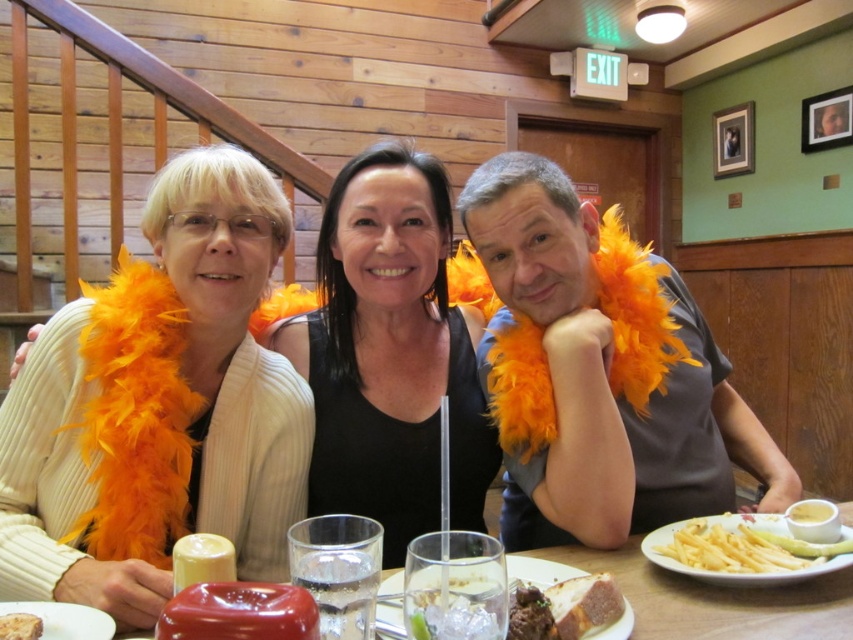
You are a waiter in a restaurant and need to serve a customer who is sitting at the table with the orange feather boa at center and the smooth white cake at center. Which item is blocking the customer from reaching the cake?

The orange feather boa at center is positioned over the smooth white cake at center, so it is blocking the customer from reaching the cake.

You are standing in a restaurant and want to sit at the table where three people are wearing orange feather boas. The table is located at point [564,285]. If you need to be at least 4 feet away from the table to avoid disturbing them, can you safely stand there?

The point [564,285] is 3.93 feet away from the viewer, which is less than the required 4 feet distance. Therefore, standing there would be too close and might disturb them.

You are a photographer standing at the entrance of the restaurant. You want to take a photo of the orange feather boa at center so that it appears sharp and in focus. Given that your camera has a minimum focusing distance of 3 feet, will you be able to take the photo without moving closer?

The orange feather boa at center is 3.45 feet away from the camera. Since the minimum focusing distance is 3 feet, the camera can focus on the orange feather boa at center as it is within the required distance.